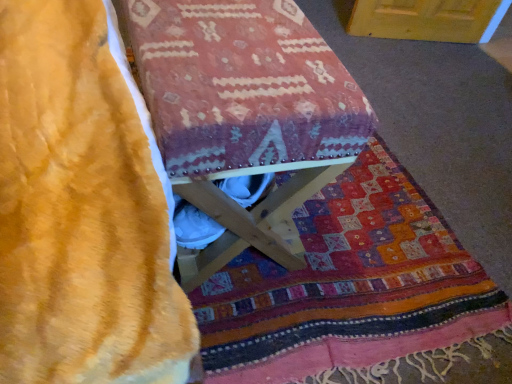
Question: Is wooden stool at center in front of or behind velvety yellow blanket at lower left in the image?

Choices:
 (A) behind
 (B) front

Answer: (B)

Question: Is wooden stool at center to the left or to the right of velvety yellow blanket at lower left in the image?

Choices:
 (A) left
 (B) right

Answer: (A)

Question: Is wooden stool at center inside the boundaries of velvety yellow blanket at lower left, or outside?

Choices:
 (A) outside
 (B) inside

Answer: (A)

Question: Considering the positions of velvety yellow blanket at lower left and wooden stool at center in the image, is velvety yellow blanket at lower left bigger or smaller than wooden stool at center?

Choices:
 (A) small
 (B) big

Answer: (A)

Question: Is velvety yellow blanket at lower left spatially inside wooden stool at center, or outside of it?

Choices:
 (A) outside
 (B) inside

Answer: (A)

Question: Relative to wooden stool at center, is velvety yellow blanket at lower left in front or behind?

Choices:
 (A) behind
 (B) front

Answer: (A)

Question: From a real-world perspective, is velvety yellow blanket at lower left above or below wooden stool at center?

Choices:
 (A) below
 (B) above

Answer: (A)